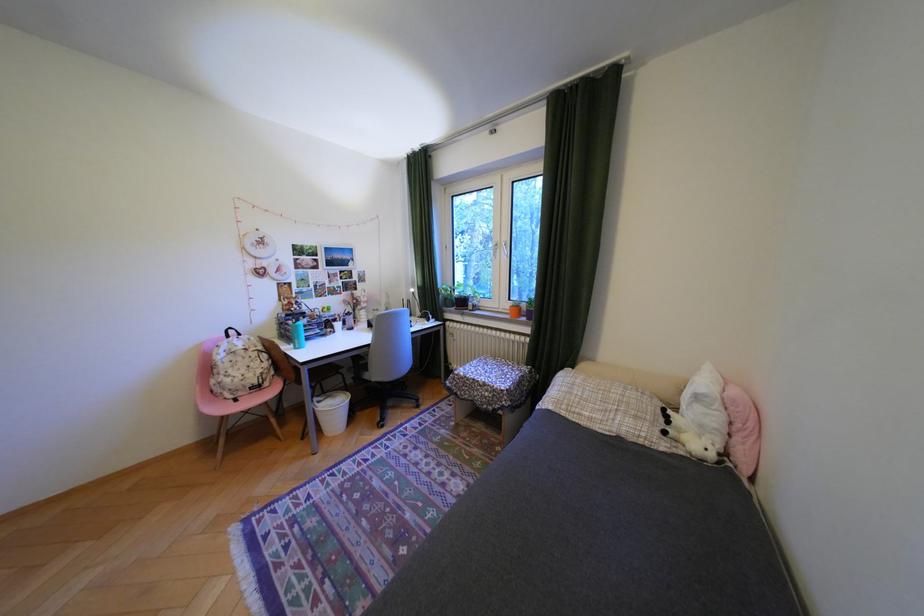
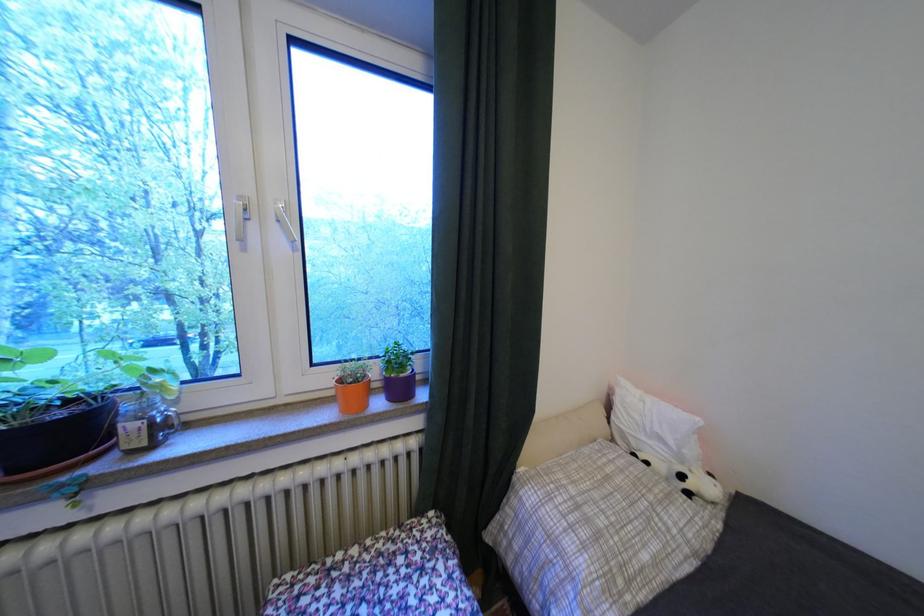
Locate, in the second image, the point that corresponds to (x=475, y=302) in the first image.

(75, 436)